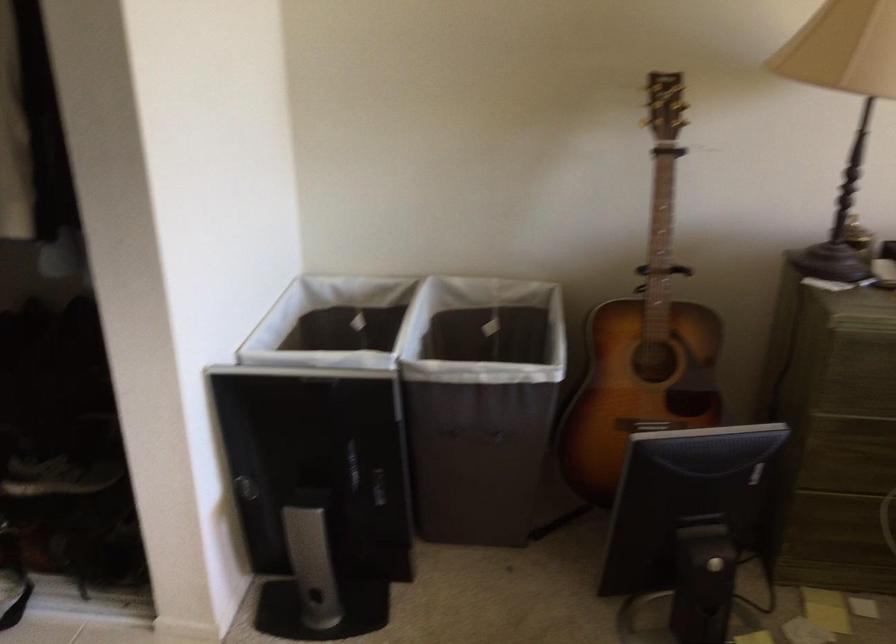
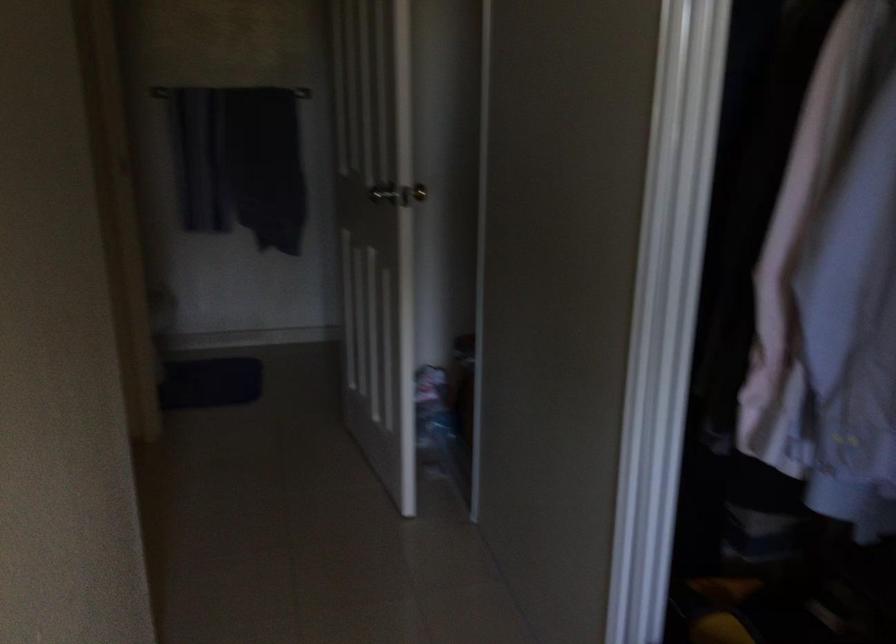
Question: The images are taken continuously from a first-person perspective. In which direction is your viewpoint rotating?

Choices:
 (A) Left
 (B) Right
 (C) Up
 (D) Down

Answer: (A)